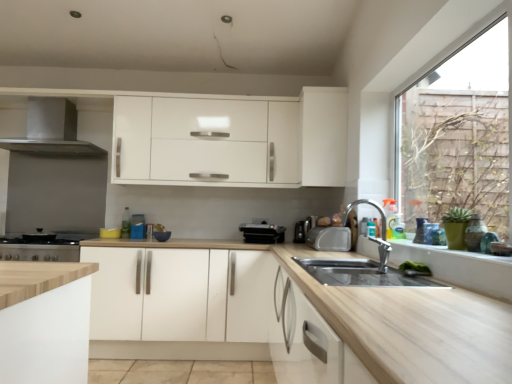
Question: In the image, is white matte cabinet at upper center, which appears as the second cabinetry when viewed from the left, on the left side or the right side of black plastic toaster at center, the second appliance in the left-to-right sequence?

Choices:
 (A) left
 (B) right

Answer: (B)

Question: From the image's perspective, is white matte cabinet at upper center, the 1th cabinetry viewed from the top, located above or below black plastic toaster at center, which appears as the fourth appliance when viewed from the right?

Choices:
 (A) above
 (B) below

Answer: (A)

Question: Estimate the real-world distances between objects in this image. Which object is farther from the white wood window sill at lower right?

Choices:
 (A) black plastic toaster at center, which appears as the fourth appliance when viewed from the right
 (B) satin silver toaster at upper right, the 5th appliance when ordered from left to right
 (C) satin silver toaster at center, which ranks as the 2th appliance in right-to-left order
 (D) satin silver exhaust hood at left
 (E) stainless steel stove at lower left, which ranks as the first appliance in left-to-right order

Answer: (D)

Question: Considering the real-world distances, which object is closest to the white matte cabinet at upper center, which ranks as the 2th cabinetry in bottom-to-top order?

Choices:
 (A) stainless steel stove at lower left, which ranks as the first appliance in left-to-right order
 (B) satin silver exhaust hood at left
 (C) satin black toaster at center, the third appliance in the right-to-left sequence
 (D) white wood window sill at lower right
 (E) white matte cabinet at center, which ranks as the 1th cabinetry in bottom-to-top order

Answer: (C)